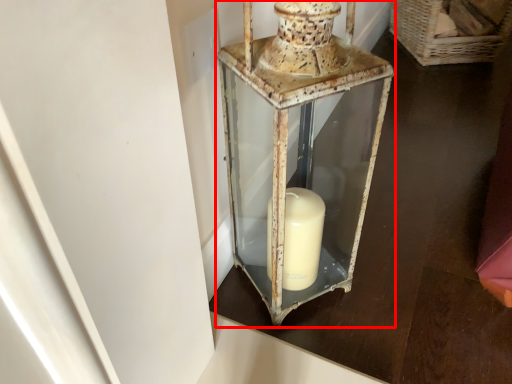
Question: From the image's perspective, considering the relative positions of lantern (annotated by the red box) and basket in the image provided, where is lantern (annotated by the red box) located with respect to the staircase?

Choices:
 (A) above
 (B) below

Answer: (B)